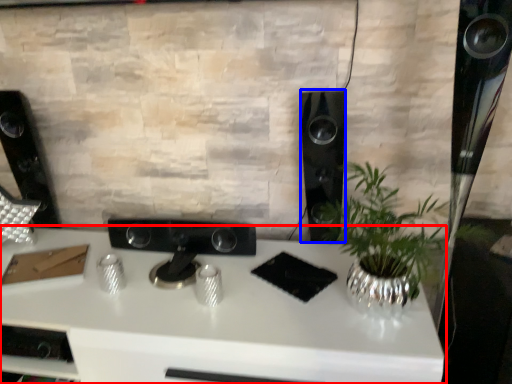
Question: Which object is closer to the camera taking this photo, desk (highlighted by a red box) or speaker (highlighted by a blue box)?

Choices:
 (A) desk
 (B) speaker

Answer: (A)